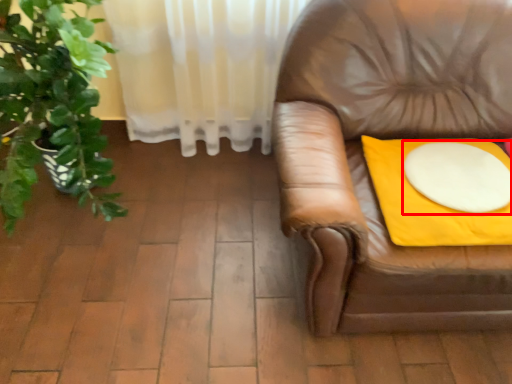
Question: From the image's perspective, what is the correct spatial relationship of round table (annotated by the red box) in relation to blanket?

Choices:
 (A) below
 (B) above

Answer: (B)